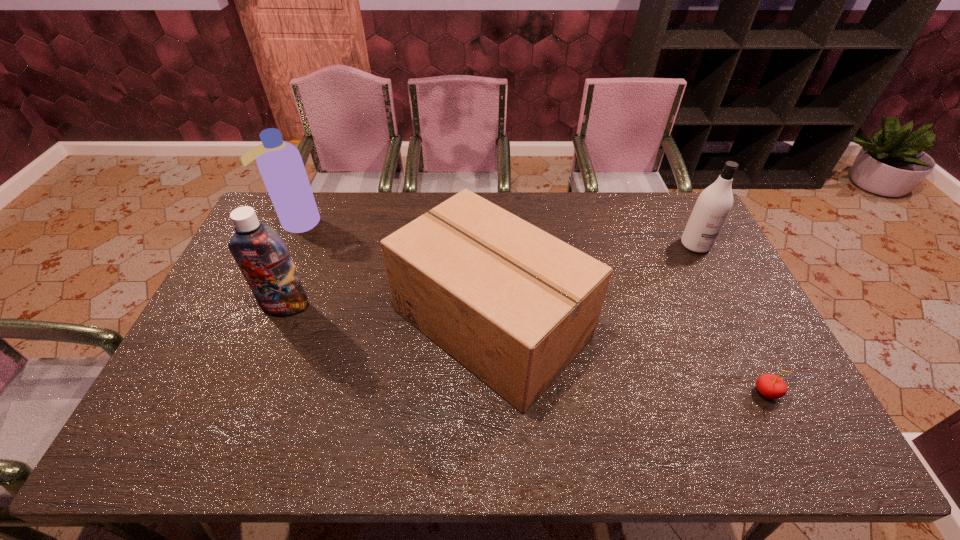
Where is `cherry that is at the right edge`? The width and height of the screenshot is (960, 540). cherry that is at the right edge is located at coordinates coord(771,386).

This screenshot has width=960, height=540. Find the location of `object that is at the far left corner`. object that is at the far left corner is located at coordinates (280, 164).

Identify the location of vacant space at the far edge of the desktop. (391, 229).

Image resolution: width=960 pixels, height=540 pixels. In the image, there is a desktop. Find the location of `vacant space at the near edge`. vacant space at the near edge is located at coordinates (641, 435).

You are a GUI agent. You are given a task and a screenshot of the screen. Output one action in this format:
    pyautogui.click(x=<x>, y=<y>)
    Task: Click on the free space at the left edge
    
    Given the screenshot: What is the action you would take?
    pyautogui.click(x=296, y=243)

I want to click on vacant region between the shortest object and the rightmost shampoo, so click(x=731, y=319).

Locate an element on the screen. The image size is (960, 540). free point between the box and the cherry is located at coordinates (629, 358).

The image size is (960, 540). Identify the location of empty location between the shortest object and the rightmost shampoo. (731, 319).

The image size is (960, 540). In order to click on vacant space that's between the shortest object and the rightmost shampoo in this screenshot , I will do `click(731, 319)`.

Locate an element on the screen. The height and width of the screenshot is (540, 960). vacant space that is in between the nearest shampoo and the box is located at coordinates (388, 315).